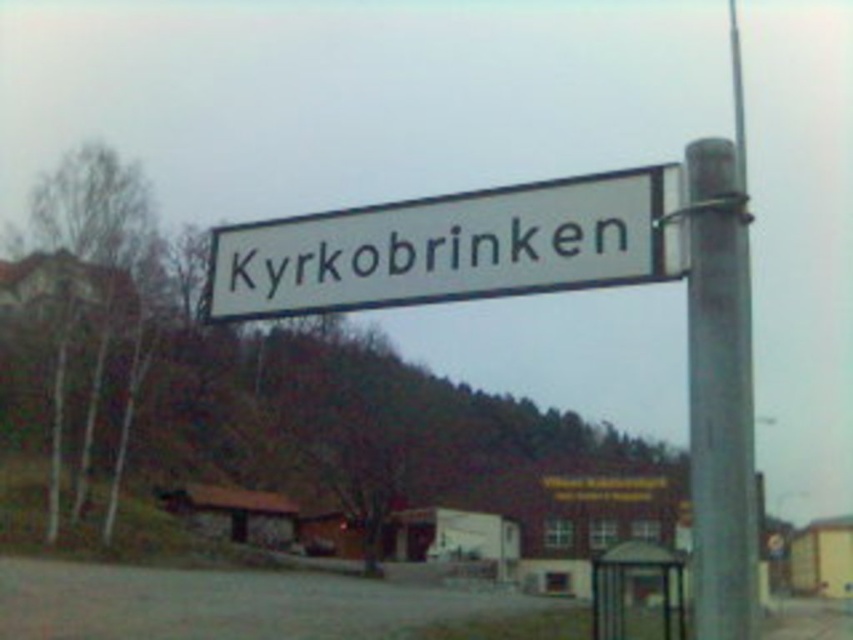
Question: Among these objects, which one is nearest to the camera?

Choices:
 (A) white plastic street sign at center
 (B) metallic gray pole at right

Answer: (B)

Question: Is white plastic street sign at center thinner than metallic gray pole at right?

Choices:
 (A) no
 (B) yes

Answer: (B)

Question: Does white plastic street sign at center have a greater width compared to metallic gray pole at right?

Choices:
 (A) no
 (B) yes

Answer: (A)

Question: Which of the following is the farthest from the observer?

Choices:
 (A) (747, 268)
 (B) (509, 275)

Answer: (B)

Question: Can you confirm if white plastic street sign at center is bigger than metallic gray pole at right?

Choices:
 (A) yes
 (B) no

Answer: (B)